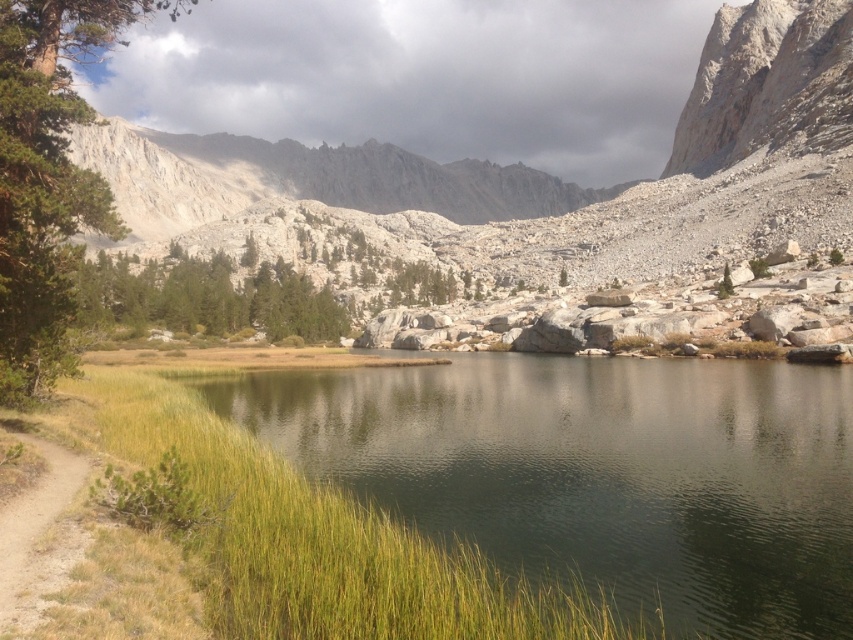
Question: Where is green grass at lower left located in relation to green textured tree at center in the image?

Choices:
 (A) right
 (B) left

Answer: (A)

Question: Which object is positioned farthest from the green leafy tree at left?

Choices:
 (A) rugged granite mountain at center
 (B) green textured tree at center
 (C) green grass at lower left

Answer: (A)

Question: Does rugged granite mountain at center have a larger size compared to green textured tree at center?

Choices:
 (A) yes
 (B) no

Answer: (A)

Question: Estimate the real-world distances between objects in this image. Which object is closer to the green leafy tree at left?

Choices:
 (A) rugged granite mountain at center
 (B) brown dirt path at lower left

Answer: (B)

Question: Observing the image, what is the correct spatial positioning of rugged granite mountain at center in reference to green textured tree at center?

Choices:
 (A) left
 (B) right

Answer: (B)

Question: Which point is closer to the camera?

Choices:
 (A) (515, 628)
 (B) (219, 328)
 (C) (15, 356)
 (D) (73, 545)

Answer: (A)